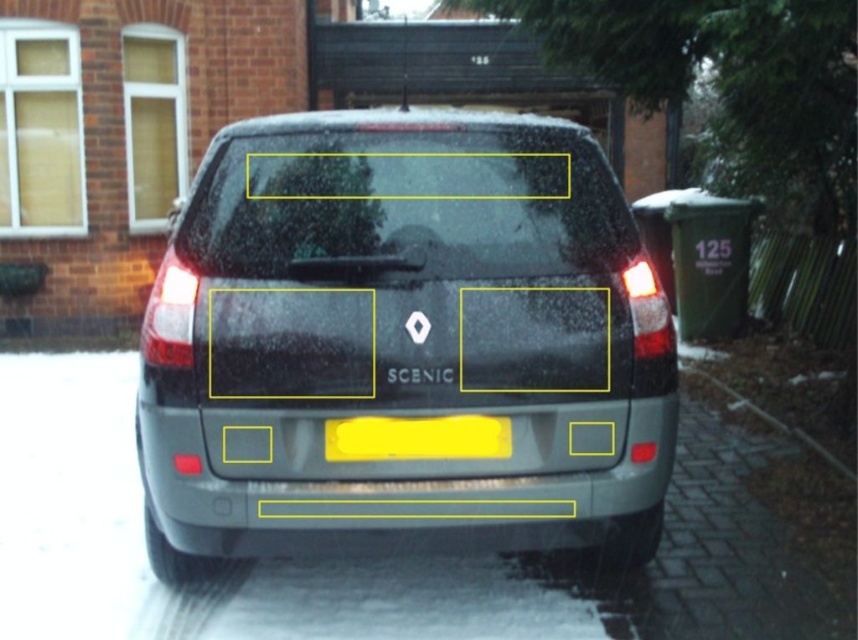
You are a delivery person trying to read the license plate of the Renault Scenic parked on the driveway. However, the transparent glass windshield at upper center is obstructing your view. Can you still see the yellow matte license plate at center clearly?

The transparent glass windshield at upper center is bigger than the yellow matte license plate at center, so it might block the view of the license plate. However, since the windshield is transparent, you might still be able to see the license plate through it, but the obstruction could make it harder to read clearly.

You are standing in front of the Renault Scenic parked on the driveway. There are two points marked on the car. The first point is at coordinates point (629, 262) and the second is at point (506, 420). Which point is closer to the rear bumper of the car?

Point (506, 420) is closer to the rear bumper of the car because it is in front of point (629, 262), which is further back.

You are standing in front of a Renault Scenic parked on a driveway. The car is positioned slightly off center with its left side closer to you. There is a point at coordinate point (269,195). Can you estimate how far this point is from you in feet?

The distance of point (269,195) from viewer is 11.87 feet.